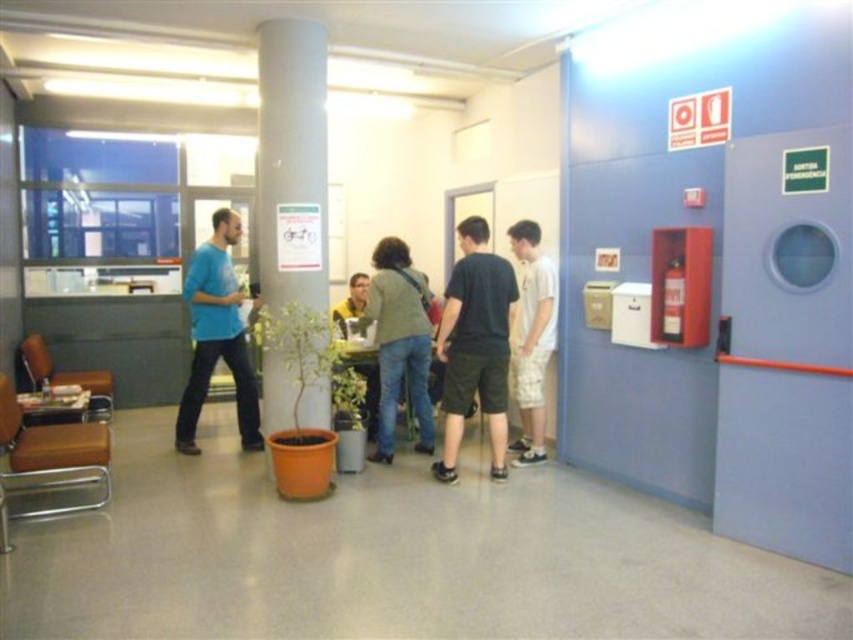
Question: Can you confirm if dark green shorts at center is bigger than yellow shirt at center?

Choices:
 (A) yes
 (B) no

Answer: (A)

Question: Is blue cotton shirt at center to the left of yellow shirt at center from the viewer's perspective?

Choices:
 (A) no
 (B) yes

Answer: (B)

Question: Does dark green shorts at center come in front of blue cotton shirt at center?

Choices:
 (A) no
 (B) yes

Answer: (B)

Question: Considering the real-world distances, which object is farthest from the denim jeans at center?

Choices:
 (A) white cotton shirt at right
 (B) gray matte pillar at center
 (C) yellow shirt at center
 (D) dark green shorts at center

Answer: (B)

Question: Which of the following is the closest to the observer?

Choices:
 (A) (448, 280)
 (B) (397, 385)

Answer: (B)

Question: Which is nearer to the denim jeans at center?

Choices:
 (A) white cotton shirt at right
 (B) dark green shorts at center

Answer: (B)